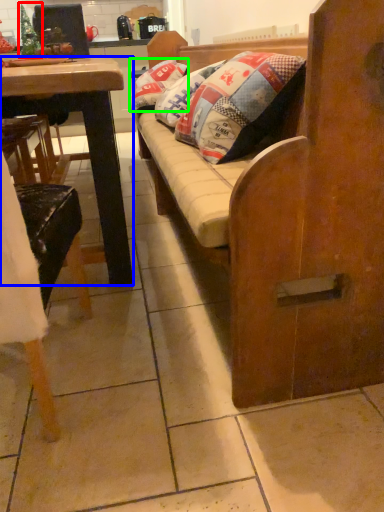
Question: Which object is positioned closest to christmas tree (highlighted by a red box)? Select from desk (highlighted by a blue box) and pillow (highlighted by a green box).

Choices:
 (A) desk
 (B) pillow

Answer: (B)